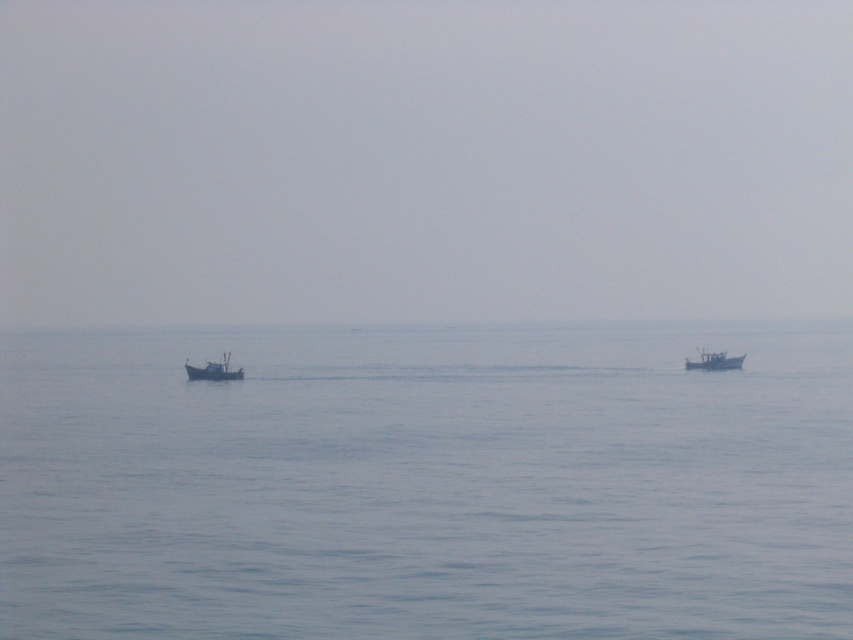
Question: Can you confirm if wooden fishing boat at left is thinner than metallic gray boat at right?

Choices:
 (A) yes
 (B) no

Answer: (A)

Question: Which point is farther to the camera?

Choices:
 (A) blue water at center
 (B) gray matte sea at center

Answer: (B)

Question: Does gray matte sea at center appear on the right side of blue water at center?

Choices:
 (A) no
 (B) yes

Answer: (A)

Question: Which object is closer to the camera taking this photo?

Choices:
 (A) metallic gray boat at right
 (B) gray matte sea at center
 (C) wooden fishing boat at left
 (D) blue water at center

Answer: (D)

Question: Is wooden fishing boat at left wider than metallic gray boat at right?

Choices:
 (A) yes
 (B) no

Answer: (B)

Question: Which of the following is the closest to the observer?

Choices:
 (A) wooden fishing boat at left
 (B) metallic gray boat at right
 (C) blue water at center
 (D) gray matte sea at center

Answer: (C)